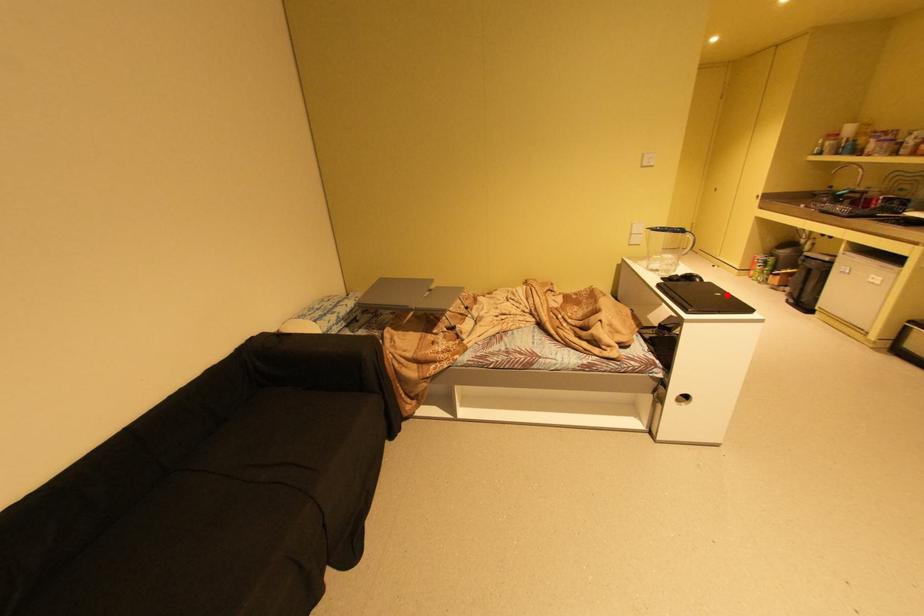
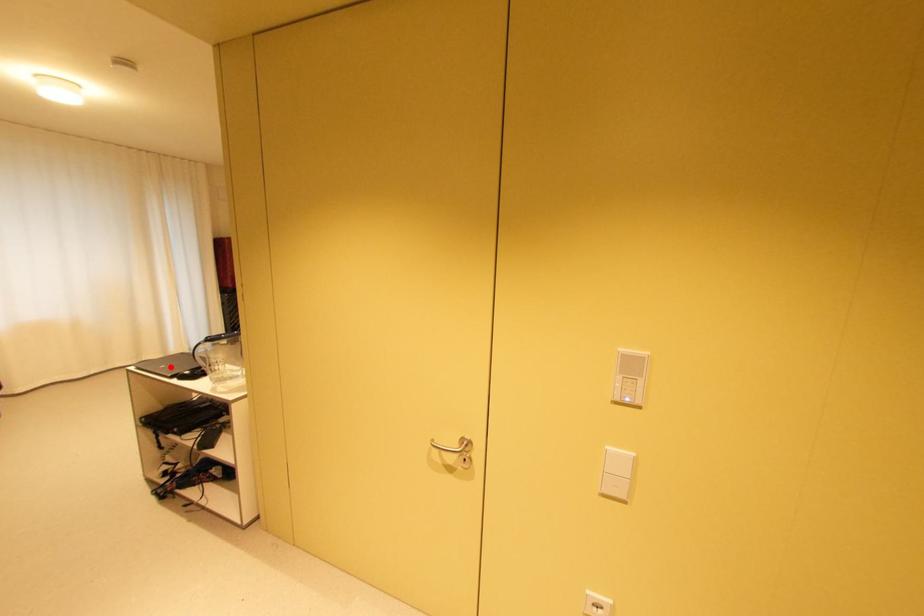
I am providing you with two images of the same scene from different viewpoints. A red point is marked on the first image and another point is marked on the second image. Does the point marked in image1 correspond to the same location as the one in image2?

Yes